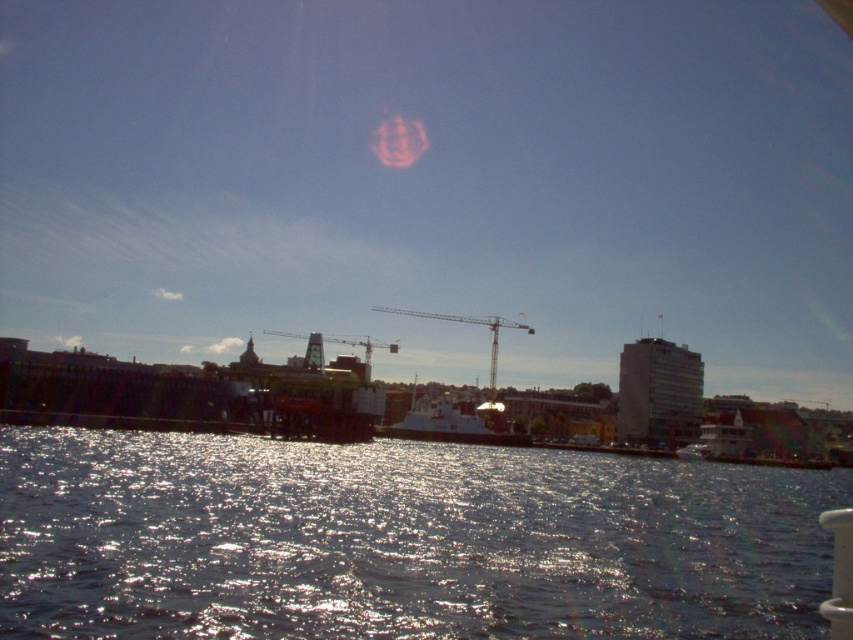
You are standing at the waterfront and see two points marked in the scene. Which point is closer to you, point [256,524] or point [378,308]?

Point [256,524] is closer to the viewer than point [378,308].